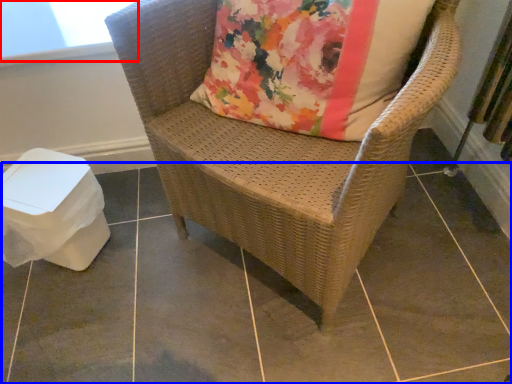
Question: Which point is further to the camera, window screen (highlighted by a red box) or tile (highlighted by a blue box)?

Choices:
 (A) window screen
 (B) tile

Answer: (A)